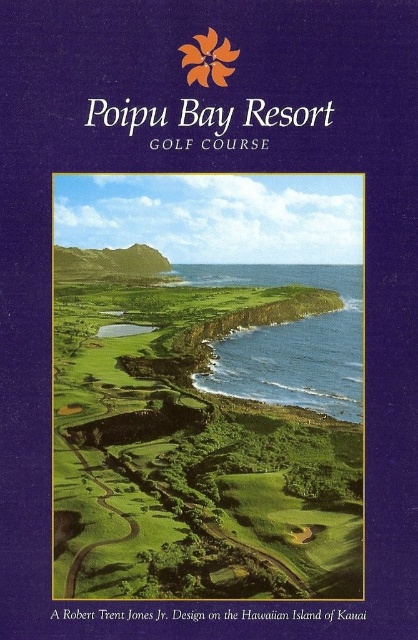
Question: Can you confirm if green grassy golf course at center is positioned above blue water at center?

Choices:
 (A) no
 (B) yes

Answer: (A)

Question: Does green grassy golf course at center have a greater width compared to blue water at center?

Choices:
 (A) yes
 (B) no

Answer: (B)

Question: Which object appears closest to the camera in this image?

Choices:
 (A) green grassy golf course at center
 (B) blue water at center

Answer: (A)

Question: Can you confirm if green grassy golf course at center is bigger than blue water at center?

Choices:
 (A) no
 (B) yes

Answer: (A)